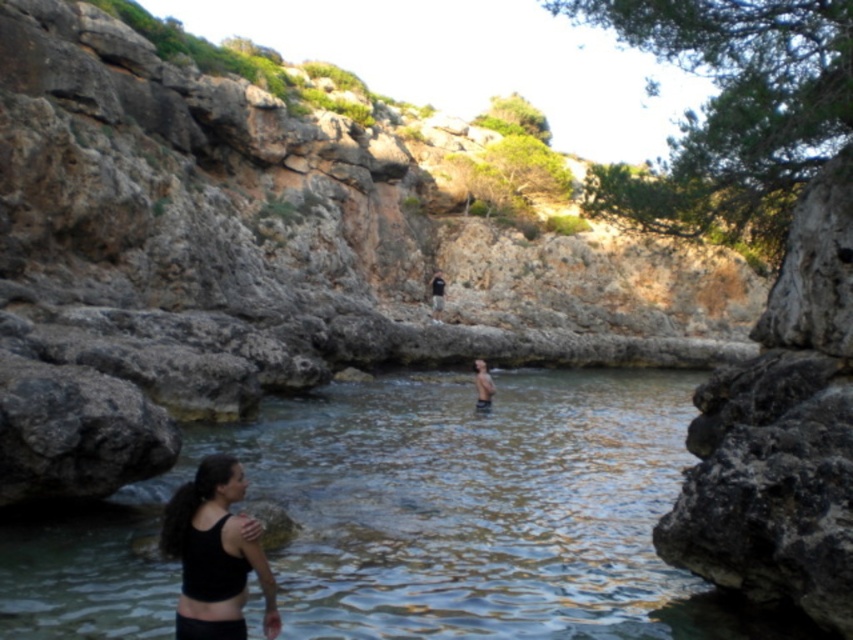
You are standing at the edge of the cove and want to take a photo of the clear water at center and the black matte tank top at lower left. To ensure both are in focus, where should you position your camera?

Position the camera so it is level with the black matte tank top at lower left, as the clear water at center is below it, ensuring both are within the same focal plane.

You are standing on the shore of the cove and see the clear water at center and the skinny man at center. Which object is positioned to the left of the other?

The clear water at center is to the left of the skinny man at center.

Based on the photo, you are planning to take a photo of the clear water at center and the black matte tank top at lower left in the scene. To ensure both are in focus, what is the minimum distance you should set the camera focus?

The clear water at center and black matte tank top at lower left are 32.30 feet apart. To ensure both are in focus, the camera should be focused at the hyperfocal distance, which would allow the entire depth of field from 0 to infinity to be sharp. Alternatively, you can focus approximately 1.3 times the distance from the nearest subject to achieve acceptable sharpness for both objects.